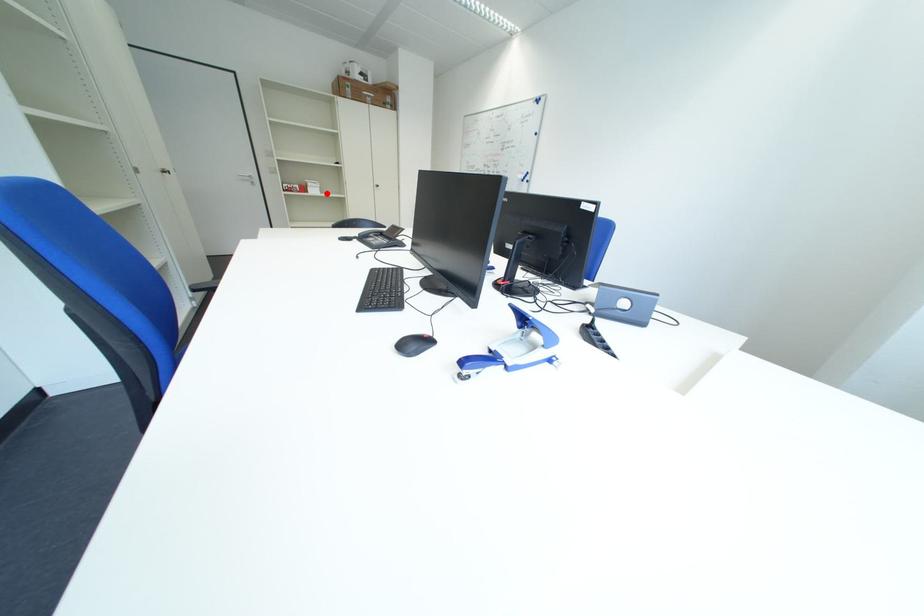
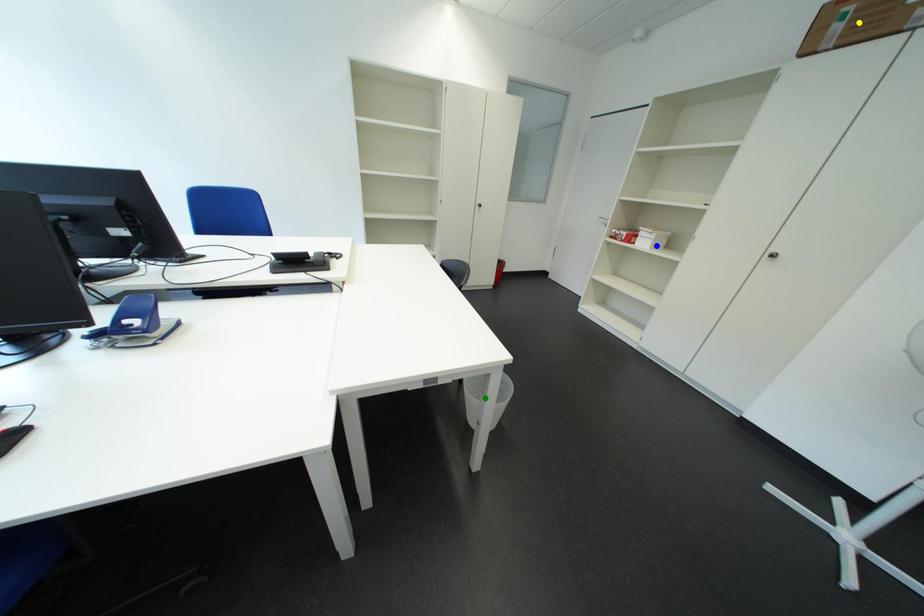
Question: I am providing you with two images of the same scene from different viewpoints. A red point is marked on the first image. You are given multiple points on the second image. Can you choose the point in image 2 that corresponds to the point in image 1?

Choices:
 (A) green point
 (B) yellow point
 (C) blue point

Answer: (C)